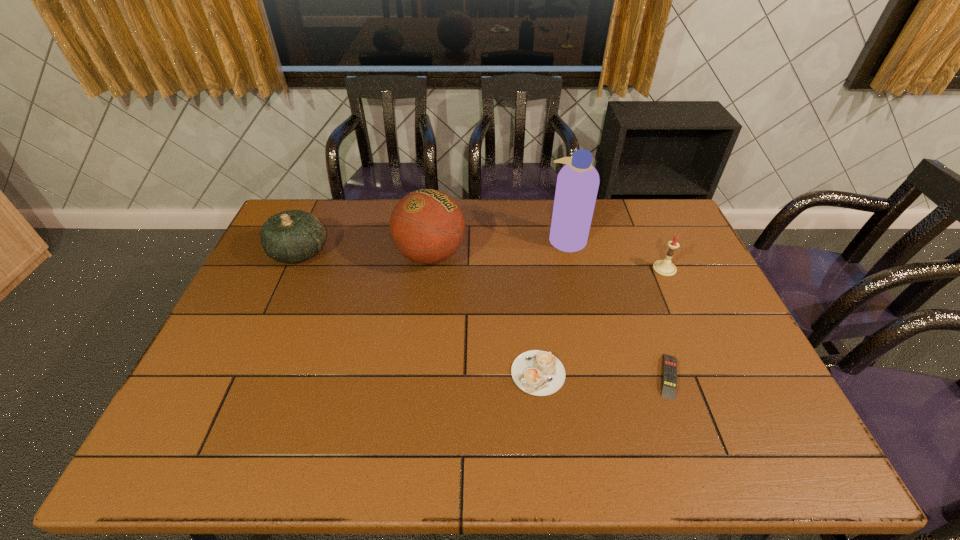
Where is `object that is the second closest to the second tallest object`? object that is the second closest to the second tallest object is located at coordinates (577, 185).

The image size is (960, 540). In order to click on blank space that satisfies the following two spatial constraints: 1. on the front side of the leftmost object; 2. on the right side of the fifth tallest object in this screenshot , I will do `click(244, 373)`.

The width and height of the screenshot is (960, 540). Find the location of `free space that satisfies the following two spatial constraints: 1. on the front side of the fourth object from left to right; 2. on the left side of the rightmost object`. free space that satisfies the following two spatial constraints: 1. on the front side of the fourth object from left to right; 2. on the left side of the rightmost object is located at coordinates (573, 269).

Where is `free spot that satisfies the following two spatial constraints: 1. on the back side of the cappuccino; 2. on the left side of the third shortest object`? The width and height of the screenshot is (960, 540). free spot that satisfies the following two spatial constraints: 1. on the back side of the cappuccino; 2. on the left side of the third shortest object is located at coordinates (526, 269).